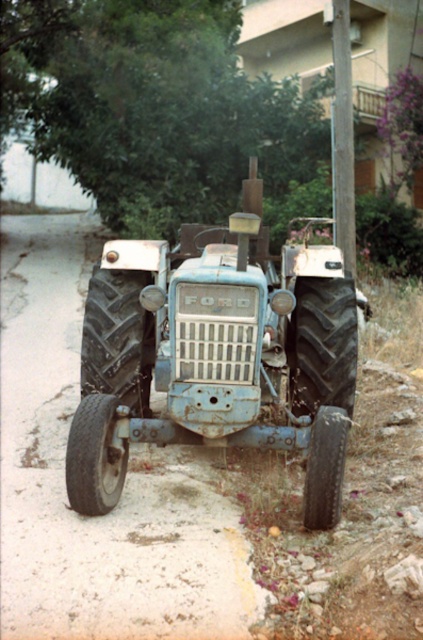
You are standing at the point labeled point (348,246) and want to walk to the point labeled point (96,497). Given that the tractor is between these two points, will you have to go around the tractor to reach your destination?

Yes, you will have to go around the tractor because point (96,497) is in front of point (348,246), meaning the tractor is blocking the direct path between them.

You are a farmer planning to attach a sign to the smooth wooden pole at upper center to indicate the direction to the tractor. Based on their positions, will the sign need to point downward or upward to direct someone to the rusty blue tractor at center?

The rusty blue tractor at center is below the smooth wooden pole at upper center, so the sign should point downward to direct someone to the tractor.

You are a farmer who needs to transport a large bale of hay. You have a rusty blue tractor at center and a smooth wooden pole at upper center nearby. Which object can you use to carry the hay bale?

The rusty blue tractor at center has a larger size compared to the smooth wooden pole at upper center, so the farmer can use the rusty blue tractor at center to carry the hay bale.